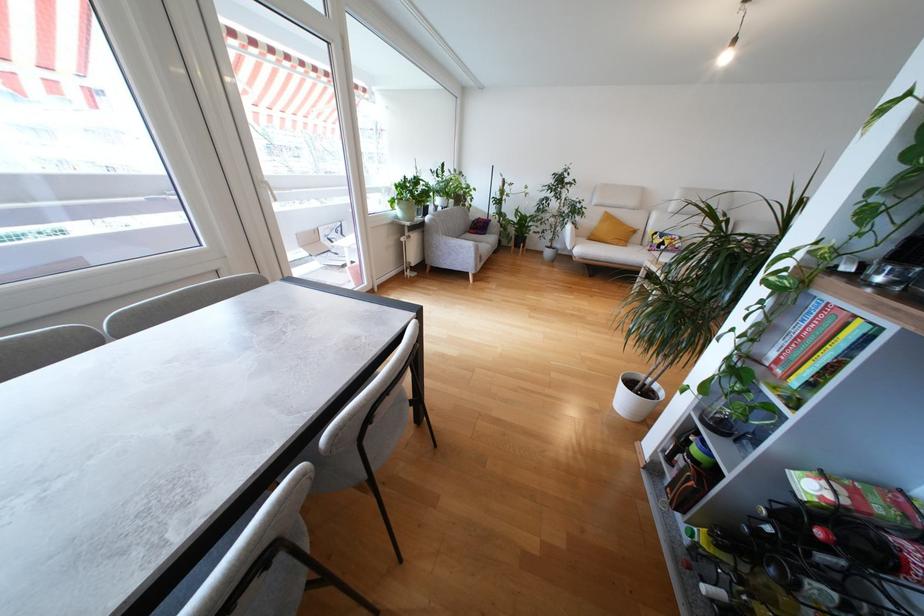
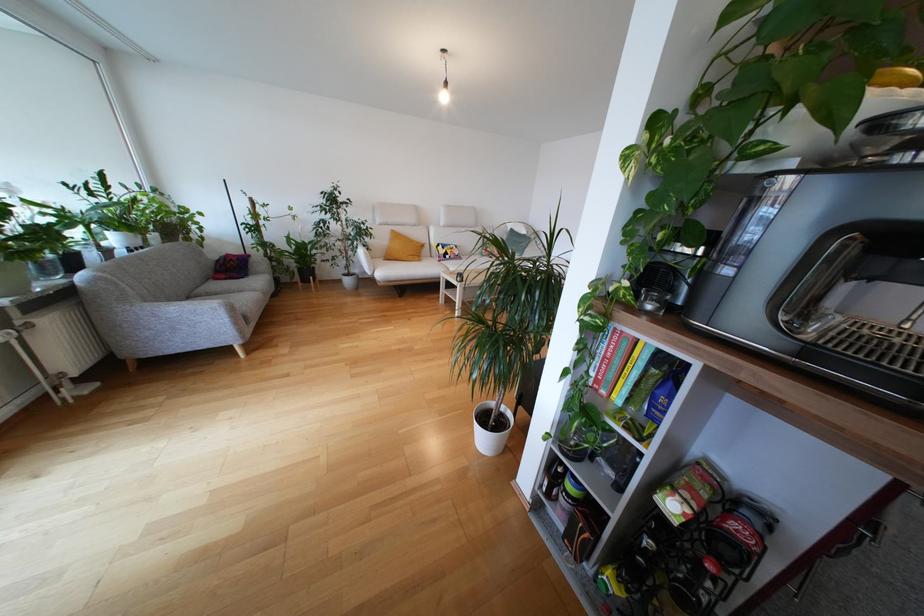
In the second image, find the point that corresponds to [405,252] in the first image.

(14, 361)